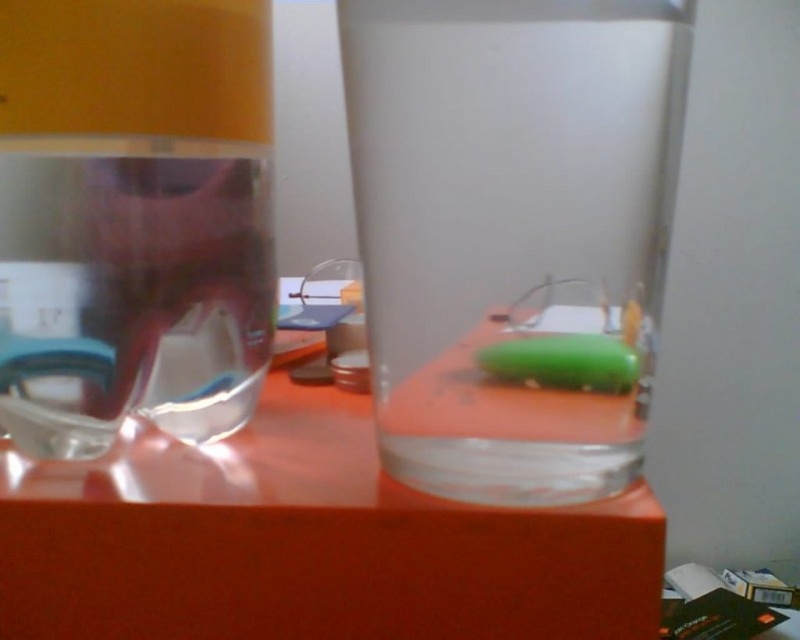
You are looking at the two points labeled as point (x=492, y=627) and point (x=68, y=344) in the image. Which point is nearer to your viewpoint?

Point (x=492, y=627) is closer to the camera than point (x=68, y=344).

You need to place a 10 cm wide book on the orange glossy table at center. The transparent plastic bottle at left is currently occupying some space. Can the book fit on the table without moving the bottle?

The orange glossy table at center might be wider than transparent plastic bottle at left, so there might be enough space to place the 10 cm wide book without moving the bottle.

You are organizing items on the orange glossy table at center and need to place the transparent plastic bottle at left. Since the table is in front of the bottle, where should you position the bottle relative to the table?

The orange glossy table at center is in front of the transparent plastic bottle at left, so you should place the transparent plastic bottle at left behind the table.